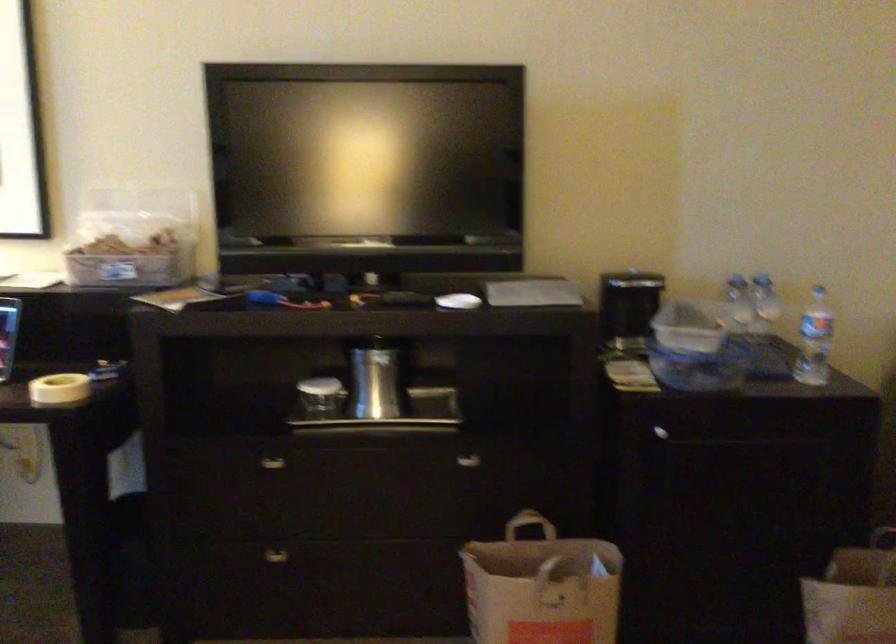
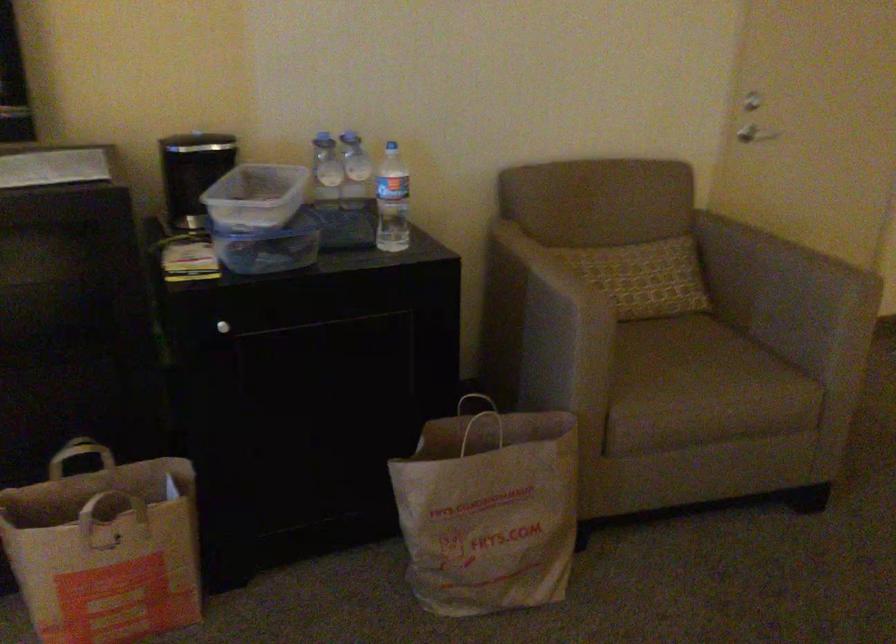
In the second image, find the point that corresponds to (x=700, y=366) in the first image.

(269, 245)